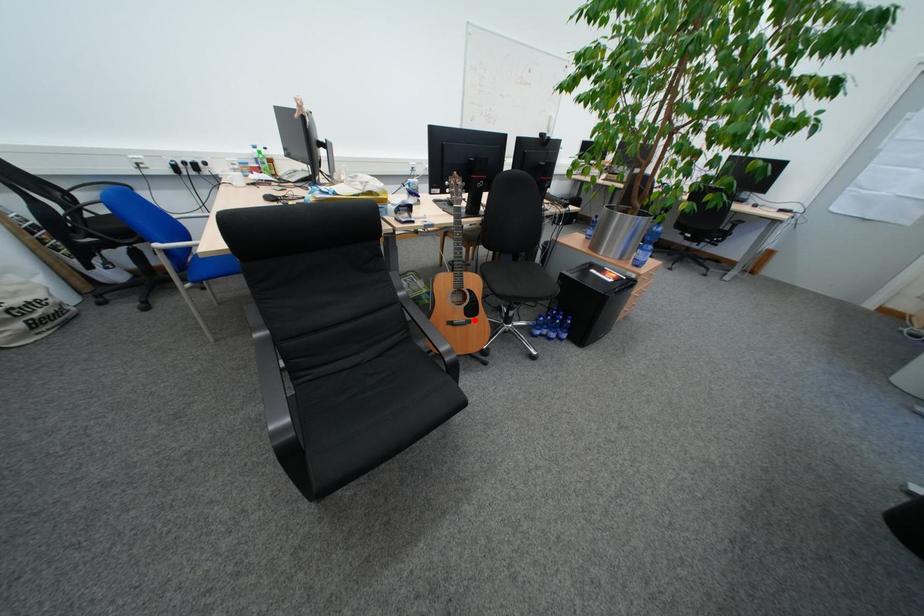
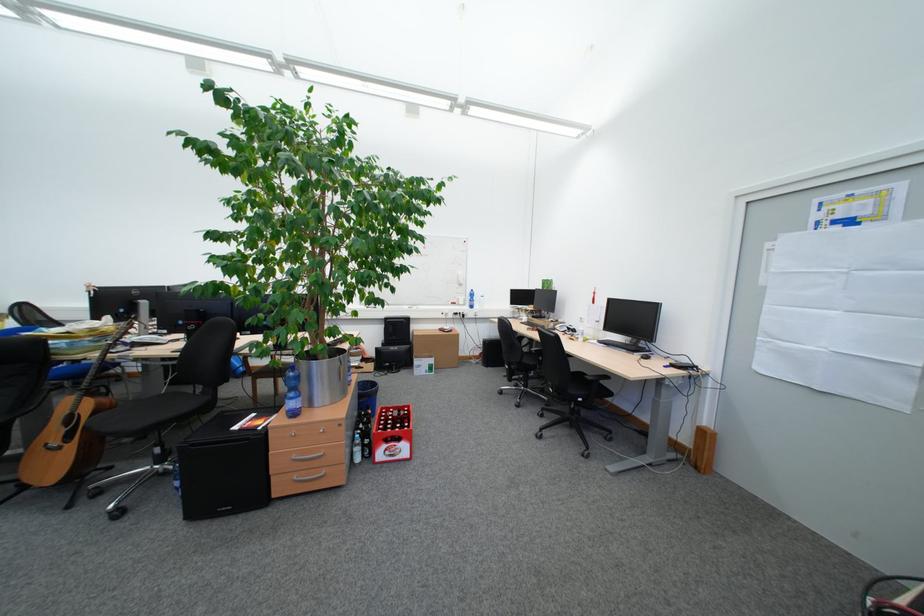
In the second image, find the point that corresponds to the highlighted location in the first image.

(68, 445)